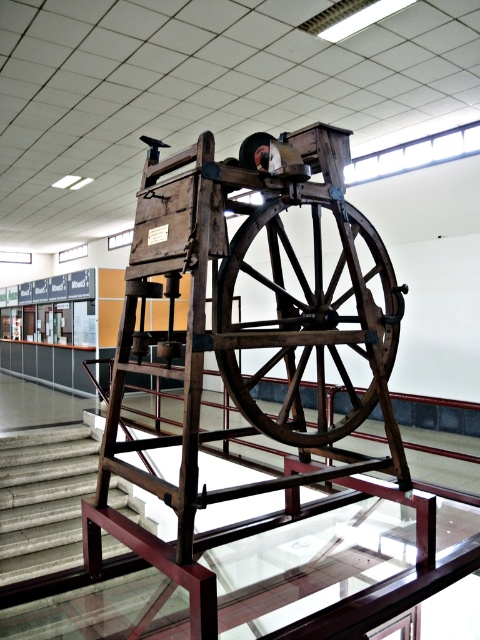
Question: Is dark brown wooden wheel at center above concrete stairs at lower left?

Choices:
 (A) yes
 (B) no

Answer: (A)

Question: Can you confirm if dark brown wooden wheel at center is positioned to the left of concrete stairs at lower left?

Choices:
 (A) yes
 (B) no

Answer: (B)

Question: Among these objects, which one is farthest from the camera?

Choices:
 (A) concrete stairs at lower left
 (B) dark brown wooden wheel at center

Answer: (A)

Question: From the image, what is the correct spatial relationship of dark brown wooden wheel at center in relation to concrete stairs at lower left?

Choices:
 (A) below
 (B) above

Answer: (B)